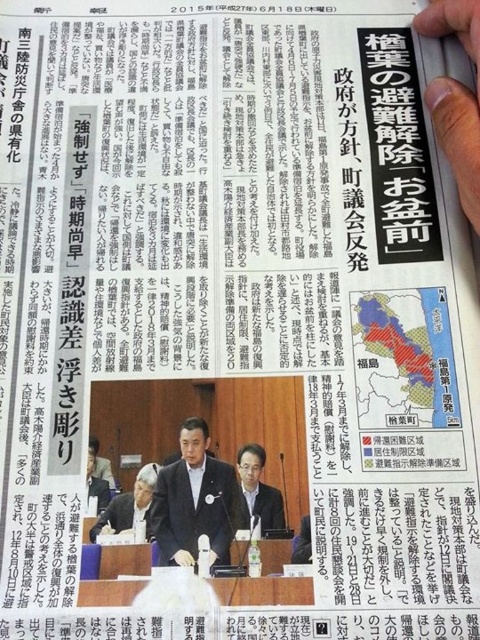
You are a fashion designer observing a Japanese newspaper page from June 18, 2015. You notice two suits displayed at the center of the page. The dark blue suit at center and the matte black suit at center. Which one has a greater width?

The dark blue suit at center has a greater width than the matte black suit at center according to the description.

What is the spatial position of the dark blue suit at center in the image?

The dark blue suit at center is located at point 0.784 on the x axis and 0.406 on the y axis.